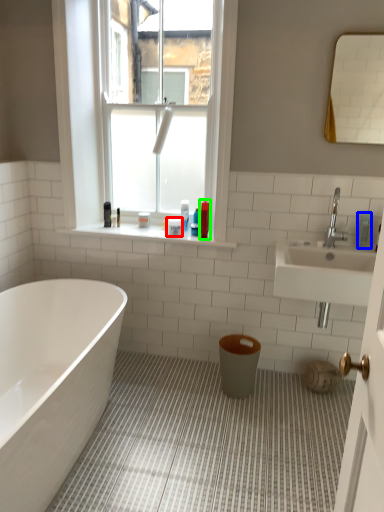
Question: Estimate the real-world distances between objects in this image. Which object is closer to toiletry (highlighted by a red box), toiletry (highlighted by a blue box) or toiletry (highlighted by a green box)?

Choices:
 (A) toiletry
 (B) toiletry

Answer: (B)